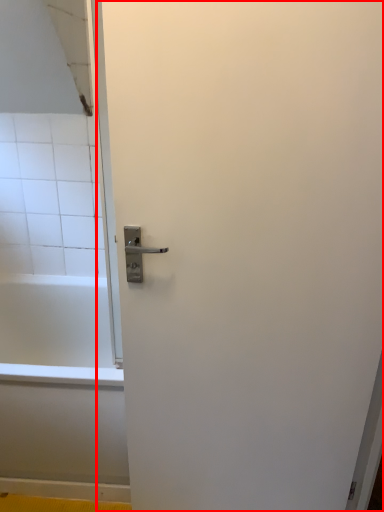
Question: From the image's perspective, what is the correct spatial positioning of screen door (annotated by the red box) in reference to bathtub?

Choices:
 (A) above
 (B) below

Answer: (A)